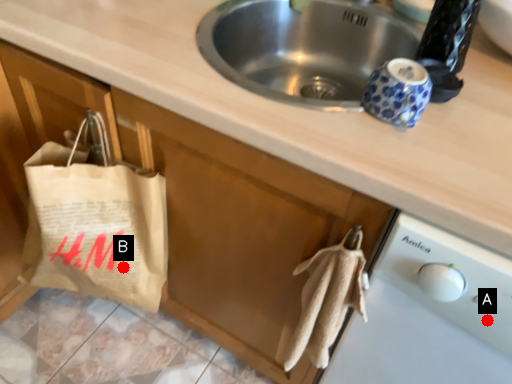
Question: Two points are circled on the image, labeled by A and B beside each circle. Which point is closer to the camera?

Choices:
 (A) A is closer
 (B) B is closer

Answer: (A)